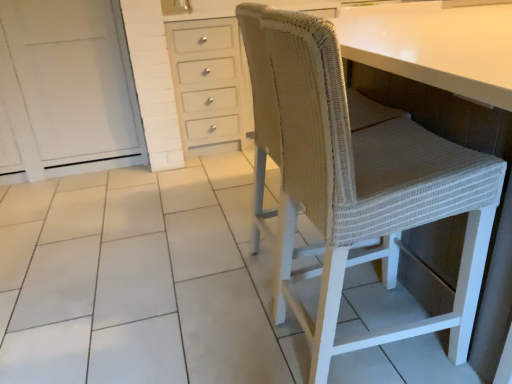
Question: From the image's perspective, is white painted wood cabinet at left positioned above or below woven beige chair at right?

Choices:
 (A) above
 (B) below

Answer: (A)

Question: Considering their positions, is white painted wood cabinet at left located in front of or behind woven beige chair at right?

Choices:
 (A) front
 (B) behind

Answer: (B)

Question: Is white painted wood cabinet at left wider or thinner than woven beige chair at right?

Choices:
 (A) wide
 (B) thin

Answer: (A)

Question: Is woven beige chair at right wider or thinner than white painted wood cabinet at left?

Choices:
 (A) wide
 (B) thin

Answer: (B)

Question: Considering the positions of woven beige chair at right and white painted wood cabinet at left in the image, is woven beige chair at right taller or shorter than white painted wood cabinet at left?

Choices:
 (A) short
 (B) tall

Answer: (A)

Question: Considering the positions of woven beige chair at right and white painted wood cabinet at left in the image, is woven beige chair at right bigger or smaller than white painted wood cabinet at left?

Choices:
 (A) small
 (B) big

Answer: (A)

Question: Is woven beige chair at right in front of or behind white painted wood cabinet at left in the image?

Choices:
 (A) behind
 (B) front

Answer: (B)